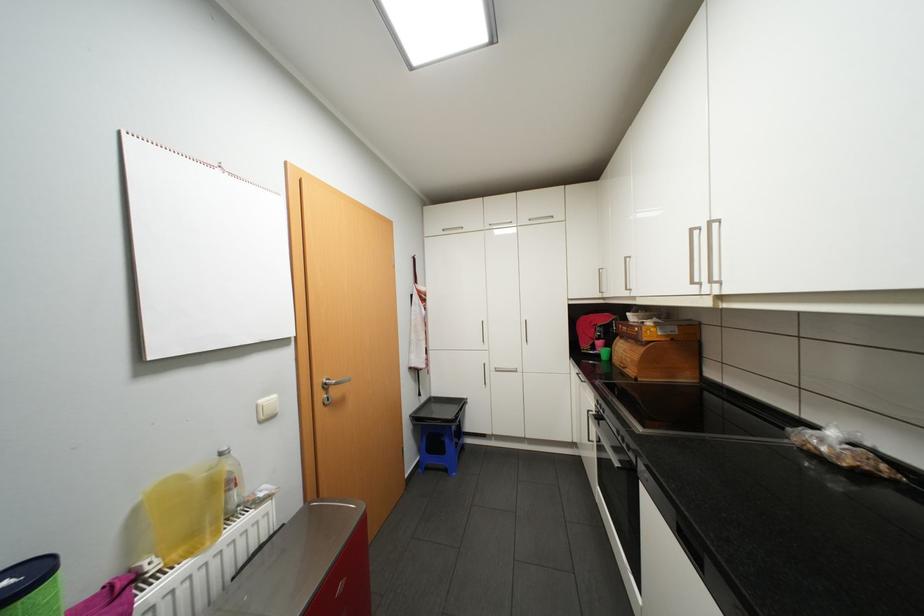
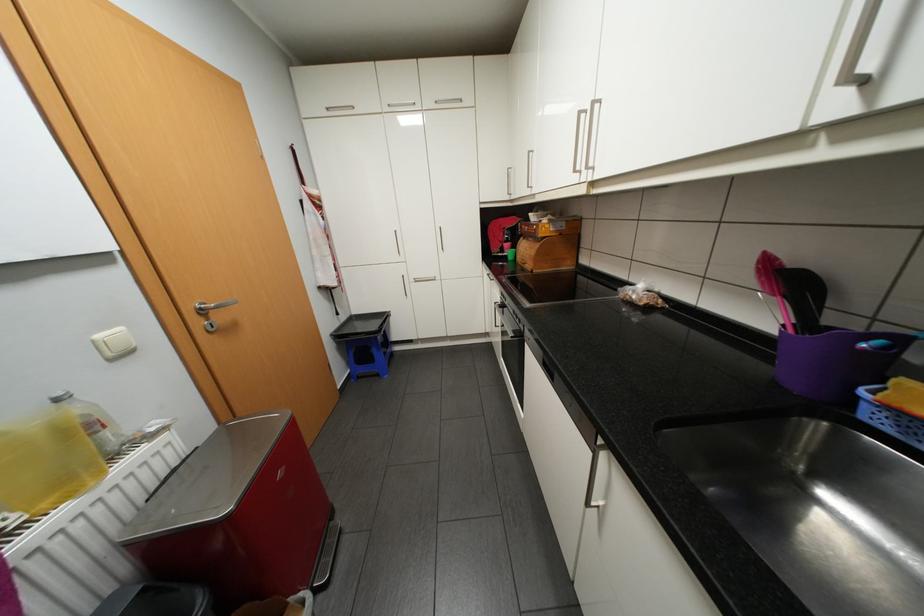
Find the pixel in the second image that matches (228,453) in the first image.

(65, 399)